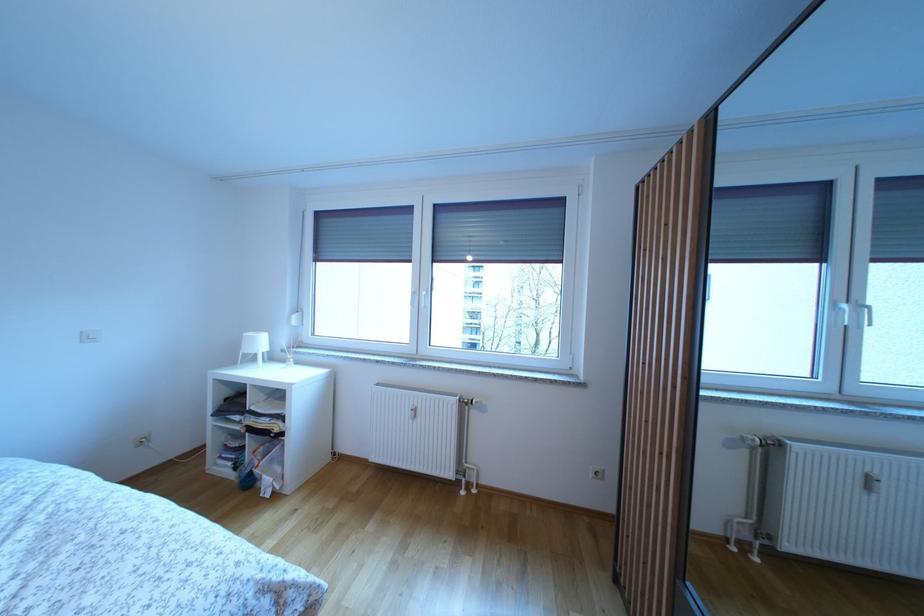
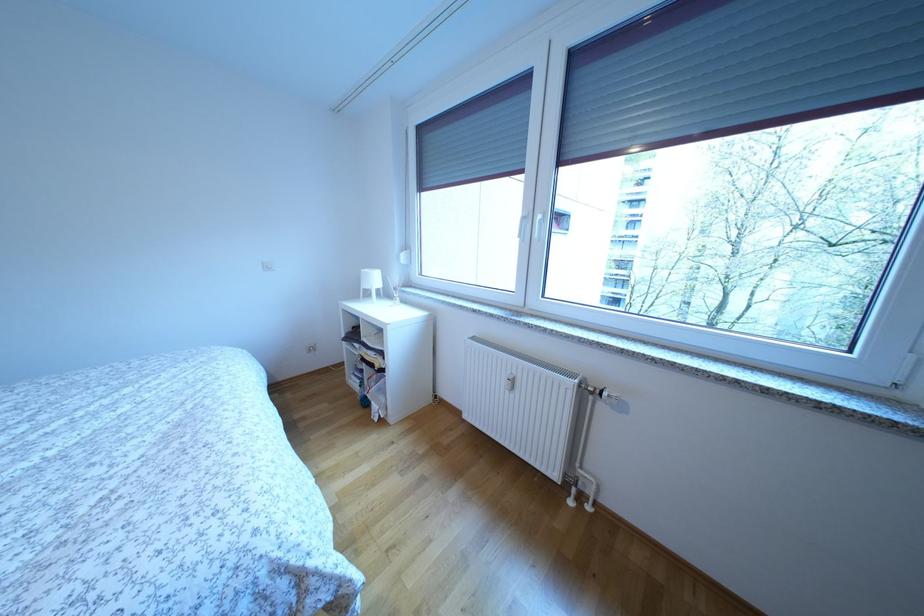
Locate, in the second image, the point that corresponds to point (423, 300) in the first image.

(535, 224)